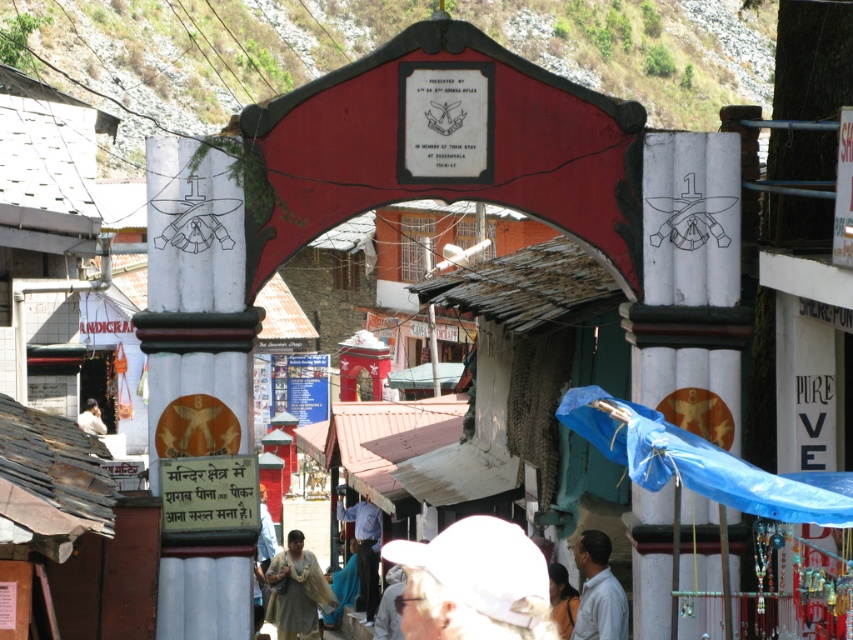
You are an architect designing a new plaza and want to ensure that the white painted stone column at center and the light beige fabric at lower left are visible from a distance. Which object will appear larger to someone standing far away?

The white painted stone column at center will appear larger because it is bigger than the light beige fabric at lower left.

You are a photographer standing at the base of the street scene. You notice the white painted stone column at left and the white matte shirt at lower center. Which object appears taller in the image?

The white matte shirt at lower center appears taller than the white painted stone column at left.